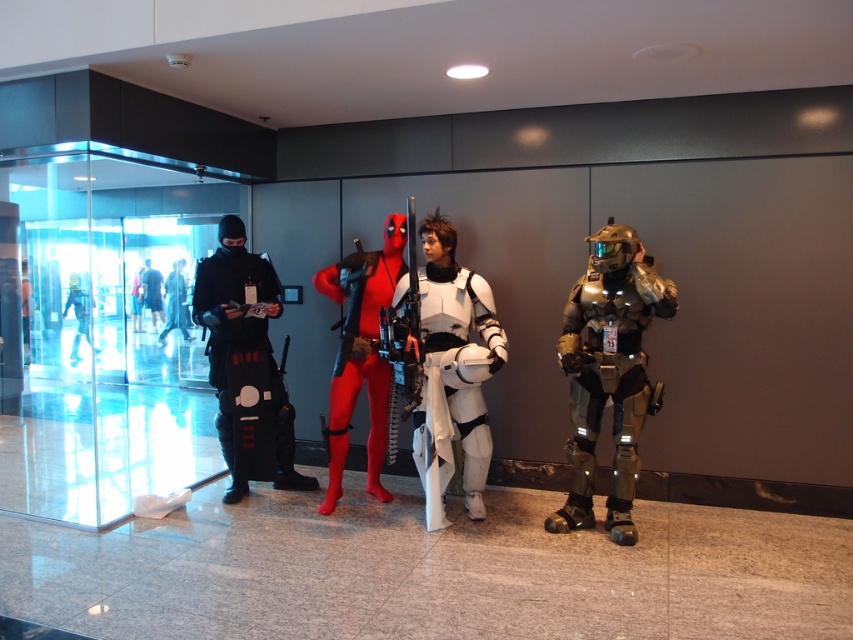
This screenshot has width=853, height=640. What do you see at coordinates (608, 372) in the screenshot? I see `gold metallic armor at right` at bounding box center [608, 372].

Which of these two, gold metallic armor at right or black matte costume at left, stands shorter?

With less height is gold metallic armor at right.

The height and width of the screenshot is (640, 853). I want to click on gold metallic armor at right, so click(608, 372).

Between white matte armor at center and black matte ninja suit at left, which one is positioned higher?

black matte ninja suit at left

From the picture: Which of these two, white matte armor at center or black matte ninja suit at left, stands shorter?

black matte ninja suit at left is shorter.

What are the coordinates of `white matte armor at center` in the screenshot? It's located at (451, 372).

At what (x,y) coordinates should I click in order to perform the action: click on white matte armor at center. Please return your answer as a coordinate pair (x, y). Image resolution: width=853 pixels, height=640 pixels. Looking at the image, I should click on (451, 372).

Is point (593, 236) farther from camera compared to point (177, 308)?

No, (593, 236) is in front of (177, 308).

Which of these two, gold metallic armor at right or black matte ninja suit at left, stands taller?

With more height is gold metallic armor at right.

Is point (577, 304) farther from viewer compared to point (175, 289)?

No.

Locate an element on the screen. The height and width of the screenshot is (640, 853). gold metallic armor at right is located at coordinates (608, 372).